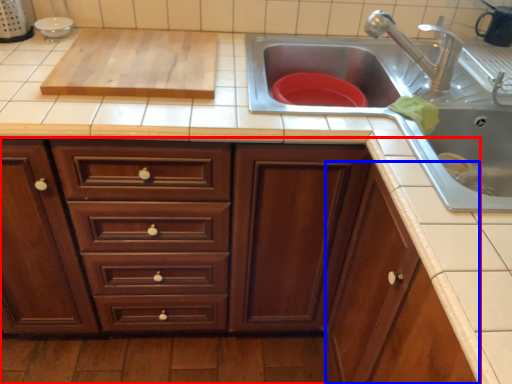
Question: Which point is closer to the camera, cabinetry (highlighted by a red box) or cabinetry (highlighted by a blue box)?

Choices:
 (A) cabinetry
 (B) cabinetry

Answer: (A)